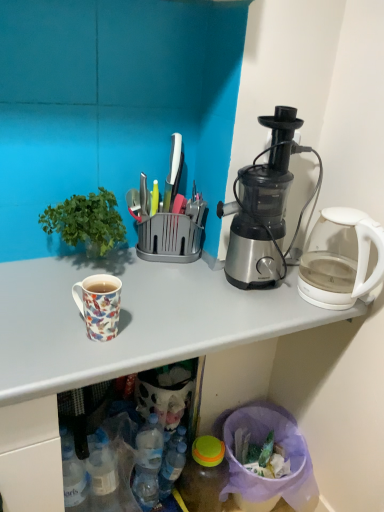
What are the coordinates of `empty space that is ontop of white glossy mug at upper left (from a real-world perspective)` in the screenshot? It's located at (177, 292).